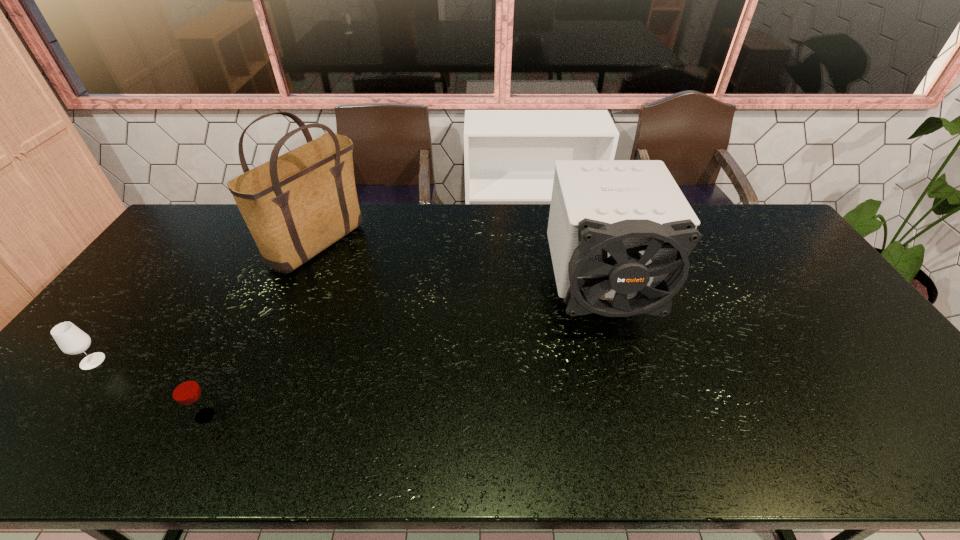
Where is `tote bag`? tote bag is located at coordinates (296, 205).

You are a GUI agent. You are given a task and a screenshot of the screen. Output one action in this format:
    pyautogui.click(x=<x>, y=<y>)
    Task: Click on the fan
    This screenshot has height=540, width=960.
    Given the screenshot: What is the action you would take?
    pyautogui.click(x=620, y=232)

I want to click on the second tallest object, so click(x=620, y=232).

The height and width of the screenshot is (540, 960). In order to click on the nearest object in this screenshot , I will do `click(184, 389)`.

This screenshot has height=540, width=960. I want to click on the nearer glass, so click(184, 389).

Identify the location of the third farthest object. This screenshot has height=540, width=960. (71, 340).

Where is `the leftmost object`? the leftmost object is located at coordinates point(71,340).

You are a GUI agent. You are given a task and a screenshot of the screen. Output one action in this format:
    pyautogui.click(x=<x>, y=<y>)
    Task: Click on the free region located on the front of the tote bag
    
    Given the screenshot: What is the action you would take?
    tap(297, 295)

Where is `vacant area situated on the front of the rightmost object`? vacant area situated on the front of the rightmost object is located at coordinates click(632, 417).

At what (x,y) coordinates should I click in order to perform the action: click on free space located 0.190m on the right of the right glass. Please return your answer as a coordinate pair (x, y). The height and width of the screenshot is (540, 960). Looking at the image, I should click on (298, 416).